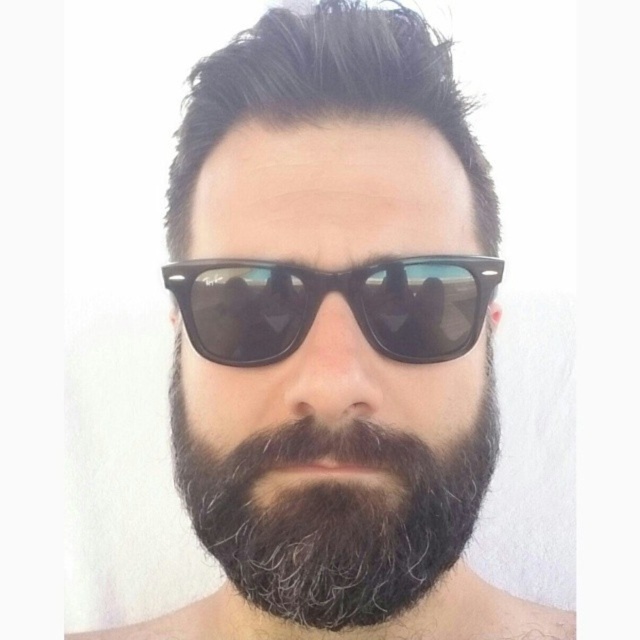
You are taking a selfie and want to ensure both the dark brown hair at center and the black plastic sunglasses at center are clearly visible. Given their sizes, which one might appear more prominent in the photo?

The dark brown hair at center has a larger size compared to the black plastic sunglasses at center, so it will appear more prominent in the photo.

You are taking a selfie and notice two features on your face. One is the dark brown textured beard at center and the other is the dark brown hair at center. Which one is located lower on your face?

The dark brown textured beard at center is positioned under the dark brown hair at center, so the dark brown textured beard at center is located lower on your face.